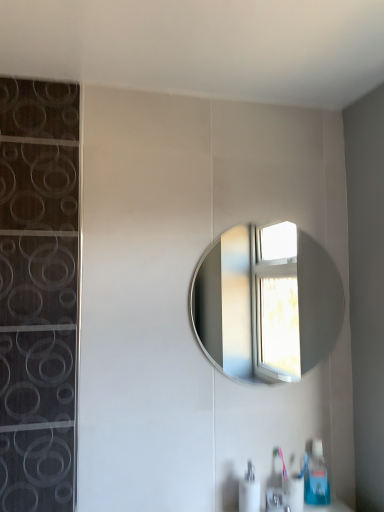
What do you see at coordinates (277, 500) in the screenshot? Image resolution: width=384 pixels, height=512 pixels. I see `satin nickel faucet at lower center` at bounding box center [277, 500].

Measure the distance between satin nickel faucet at lower center and camera.

satin nickel faucet at lower center and camera are 1.49 meters apart from each other.

What do you see at coordinates (317, 477) in the screenshot?
I see `blue plastic soap dispenser at lower right, which is the first soap dispenser from back to front` at bounding box center [317, 477].

Image resolution: width=384 pixels, height=512 pixels. I want to click on satin nickel faucet at lower center, so (277, 500).

What's the angular difference between blue plastic soap dispenser at lower right, the 1th soap dispenser when ordered from right to left, and satin nickel faucet at lower center's facing directions?

9.7 degrees.

Visually, is blue plastic soap dispenser at lower right, the 1th soap dispenser when ordered from right to left, positioned to the left or to the right of satin nickel faucet at lower center?

Clearly, blue plastic soap dispenser at lower right, the 1th soap dispenser when ordered from right to left, is on the right of satin nickel faucet at lower center in the image.

In the image, is blue plastic soap dispenser at lower right, the 2th soap dispenser viewed from the left, positioned in front of or behind satin nickel faucet at lower center?

Visually, blue plastic soap dispenser at lower right, the 2th soap dispenser viewed from the left, is located behind satin nickel faucet at lower center.

In the scene shown: Which object is closer to the camera, satin nickel faucet at lower center or white glossy soap dispenser at lower center, the 2th soap dispenser when ordered from back to front?

satin nickel faucet at lower center.

The image size is (384, 512). I want to click on soap dispenser that is the 1st one above the satin nickel faucet at lower center (from a real-world perspective), so click(x=249, y=490).

Is satin nickel faucet at lower center wider or thinner than white glossy soap dispenser at lower center, the 2th soap dispenser when ordered from back to front?

In the image, satin nickel faucet at lower center appears to be wider than white glossy soap dispenser at lower center, the 2th soap dispenser when ordered from back to front.

Is point (271, 505) closer to viewer compared to point (253, 498)?

No, (271, 505) is behind (253, 498).

Which is in front, point (289, 321) or point (251, 475)?

The point (251, 475) is closer.

From the picture: From a real-world perspective, which object rests below the other?

white glossy soap dispenser at lower center, which appears as the second soap dispenser when viewed from the right, is physically lower.

Is silver metallic mirror at center directly adjacent to white glossy soap dispenser at lower center, which appears as the second soap dispenser when viewed from the right?

silver metallic mirror at center and white glossy soap dispenser at lower center, which appears as the second soap dispenser when viewed from the right, are clearly separated.

What's the angular difference between silver metallic mirror at center and white glossy soap dispenser at lower center, the 2th soap dispenser when ordered from back to front,'s facing directions?

1.2 degrees.

In terms of size, does satin nickel faucet at lower center appear bigger or smaller than blue plastic soap dispenser at lower right, the 1th soap dispenser when ordered from right to left?

satin nickel faucet at lower center is smaller than blue plastic soap dispenser at lower right, the 1th soap dispenser when ordered from right to left.

Between satin nickel faucet at lower center and blue plastic soap dispenser at lower right, the 2th soap dispenser when ordered from front to back, which one has less height?

satin nickel faucet at lower center.

Is blue plastic soap dispenser at lower right, which is the first soap dispenser from back to front, surrounded by satin nickel faucet at lower center?

No, satin nickel faucet at lower center does not contain blue plastic soap dispenser at lower right, which is the first soap dispenser from back to front.

In the image, there is a white glossy soap dispenser at lower center, which appears as the second soap dispenser when viewed from the right. Where is `soap dispenser above it (from the image's perspective)`? soap dispenser above it (from the image's perspective) is located at coordinates (317, 477).

Considering the sizes of objects blue plastic soap dispenser at lower right, the 1th soap dispenser when ordered from right to left, and white glossy soap dispenser at lower center, which is the first soap dispenser in left-to-right order, in the image provided, who is taller, blue plastic soap dispenser at lower right, the 1th soap dispenser when ordered from right to left, or white glossy soap dispenser at lower center, which is the first soap dispenser in left-to-right order,?

blue plastic soap dispenser at lower right, the 1th soap dispenser when ordered from right to left, is taller.

Is white glossy soap dispenser at lower center, arranged as the 1th soap dispenser when viewed from the front, a part of blue plastic soap dispenser at lower right, the 2th soap dispenser viewed from the left?

Actually, white glossy soap dispenser at lower center, arranged as the 1th soap dispenser when viewed from the front, is outside blue plastic soap dispenser at lower right, the 2th soap dispenser viewed from the left.

The width and height of the screenshot is (384, 512). What are the coordinates of `faucet below the silver metallic mirror at center (from the image's perspective)` in the screenshot? It's located at (277, 500).

From a real-world perspective, is satin nickel faucet at lower center located beneath silver metallic mirror at center?

Yes, from a real-world perspective, satin nickel faucet at lower center is below silver metallic mirror at center.

Is satin nickel faucet at lower center oriented away from silver metallic mirror at center?

No.

Could you tell me if white glossy soap dispenser at lower center, the 2th soap dispenser when ordered from back to front, is facing silver metallic mirror at center?

No, white glossy soap dispenser at lower center, the 2th soap dispenser when ordered from back to front, is not turned towards silver metallic mirror at center.

This screenshot has height=512, width=384. I want to click on mirror that appears above the white glossy soap dispenser at lower center, which appears as the second soap dispenser when viewed from the right (from the image's perspective), so click(264, 304).

Considering the relative sizes of white glossy soap dispenser at lower center, which is the first soap dispenser in left-to-right order, and silver metallic mirror at center in the image provided, is white glossy soap dispenser at lower center, which is the first soap dispenser in left-to-right order, bigger than silver metallic mirror at center?

No, white glossy soap dispenser at lower center, which is the first soap dispenser in left-to-right order, is not bigger than silver metallic mirror at center.

Who is taller, white glossy soap dispenser at lower center, which is the first soap dispenser in left-to-right order, or silver metallic mirror at center?

With more height is silver metallic mirror at center.

Find the location of a particular element. faucet in front of the blue plastic soap dispenser at lower right, the 2th soap dispenser when ordered from front to back is located at coordinates (277, 500).

Where is `the 1st soap dispenser behind the satin nickel faucet at lower center, starting your count from the anchor`? the 1st soap dispenser behind the satin nickel faucet at lower center, starting your count from the anchor is located at coordinates (249, 490).

Estimate the real-world distances between objects in this image. Which object is further from silver metallic mirror at center, white glossy soap dispenser at lower center, which appears as the second soap dispenser when viewed from the right, or blue plastic soap dispenser at lower right, the 2th soap dispenser when ordered from front to back?

Among the two, white glossy soap dispenser at lower center, which appears as the second soap dispenser when viewed from the right, is located further to silver metallic mirror at center.

From the image, which object appears to be nearer to blue plastic soap dispenser at lower right, the 2th soap dispenser when ordered from front to back, satin nickel faucet at lower center or silver metallic mirror at center?

satin nickel faucet at lower center.

When comparing their distances from white glossy soap dispenser at lower center, the 2th soap dispenser when ordered from back to front, does satin nickel faucet at lower center or blue plastic soap dispenser at lower right, the 2th soap dispenser when ordered from front to back, seem further?

blue plastic soap dispenser at lower right, the 2th soap dispenser when ordered from front to back.

When comparing their distances from white glossy soap dispenser at lower center, which is the first soap dispenser in left-to-right order, does silver metallic mirror at center or blue plastic soap dispenser at lower right, the 2th soap dispenser when ordered from front to back, seem further?

Based on the image, silver metallic mirror at center appears to be further to white glossy soap dispenser at lower center, which is the first soap dispenser in left-to-right order.

When comparing their distances from satin nickel faucet at lower center, does blue plastic soap dispenser at lower right, the 2th soap dispenser when ordered from front to back, or white glossy soap dispenser at lower center, which appears as the second soap dispenser when viewed from the right, seem further?

blue plastic soap dispenser at lower right, the 2th soap dispenser when ordered from front to back, is further to satin nickel faucet at lower center.

When comparing their distances from silver metallic mirror at center, does satin nickel faucet at lower center or blue plastic soap dispenser at lower right, the 2th soap dispenser viewed from the left, seem closer?

The object closer to silver metallic mirror at center is blue plastic soap dispenser at lower right, the 2th soap dispenser viewed from the left.

Based on their spatial positions, is satin nickel faucet at lower center or white glossy soap dispenser at lower center, which is the first soap dispenser in left-to-right order, further from silver metallic mirror at center?

satin nickel faucet at lower center is further to silver metallic mirror at center.

Looking at the image, which one is located closer to blue plastic soap dispenser at lower right, the 2th soap dispenser viewed from the left, white glossy soap dispenser at lower center, the 2th soap dispenser when ordered from back to front, or silver metallic mirror at center?

Based on the image, white glossy soap dispenser at lower center, the 2th soap dispenser when ordered from back to front, appears to be nearer to blue plastic soap dispenser at lower right, the 2th soap dispenser viewed from the left.

This screenshot has width=384, height=512. Identify the location of soap dispenser between silver metallic mirror at center and white glossy soap dispenser at lower center, which is the first soap dispenser in left-to-right order, vertically. pos(317,477).

This screenshot has width=384, height=512. I want to click on faucet located between white glossy soap dispenser at lower center, which is the first soap dispenser in left-to-right order, and blue plastic soap dispenser at lower right, the 2th soap dispenser viewed from the left, in the left-right direction, so click(277, 500).